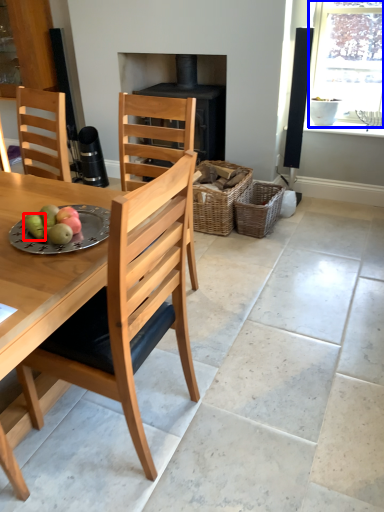
Question: Which of the following is the farthest to the observer, fruit (highlighted by a red box) or window (highlighted by a blue box)?

Choices:
 (A) fruit
 (B) window

Answer: (B)